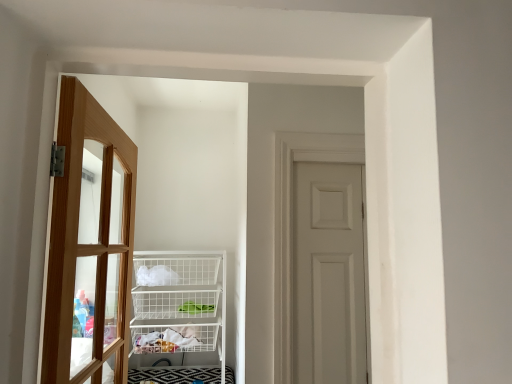
Question: From a real-world perspective, is white matte door at center, positioned as the second door in front-to-back order, on white wire basket at center?

Choices:
 (A) no
 (B) yes

Answer: (B)

Question: Is white matte door at center, placed as the 1th door when sorted from right to left, positioned behind white wire basket at center?

Choices:
 (A) no
 (B) yes

Answer: (A)

Question: Is white matte door at center, positioned as the second door in front-to-back order, directly adjacent to white wire basket at center?

Choices:
 (A) yes
 (B) no

Answer: (B)

Question: Does white matte door at center, positioned as the second door in front-to-back order, come in front of white wire basket at center?

Choices:
 (A) yes
 (B) no

Answer: (A)

Question: Does white matte door at center, placed as the 1th door when sorted from right to left, contain white wire basket at center?

Choices:
 (A) no
 (B) yes

Answer: (A)

Question: Could you tell me if white matte door at center, the 1th door when ordered from back to front, is turned towards white wire basket at center?

Choices:
 (A) no
 (B) yes

Answer: (A)

Question: From the image's perspective, is light brown wooden door at left, the 1th door from the front, beneath white wire basket at center?

Choices:
 (A) no
 (B) yes

Answer: (A)

Question: From a real-world perspective, does light brown wooden door at left, placed as the first door when sorted from left to right, stand above white wire basket at center?

Choices:
 (A) no
 (B) yes

Answer: (B)

Question: Considering the relative sizes of light brown wooden door at left, which is the 2th door from right to left, and white wire basket at center in the image provided, is light brown wooden door at left, which is the 2th door from right to left, taller than white wire basket at center?

Choices:
 (A) no
 (B) yes

Answer: (B)

Question: Could you tell me if light brown wooden door at left, the 1th door from the front, is turned towards white wire basket at center?

Choices:
 (A) no
 (B) yes

Answer: (A)

Question: Does light brown wooden door at left, which is the 2th door from right to left, have a smaller size compared to white wire basket at center?

Choices:
 (A) yes
 (B) no

Answer: (A)

Question: From the image's perspective, is light brown wooden door at left, which appears as the 2th door when viewed from the back, over white wire basket at center?

Choices:
 (A) yes
 (B) no

Answer: (A)

Question: Are light brown wooden door at left, the 1th door from the front, and white matte door at center, positioned as the second door in front-to-back order, beside each other?

Choices:
 (A) no
 (B) yes

Answer: (A)